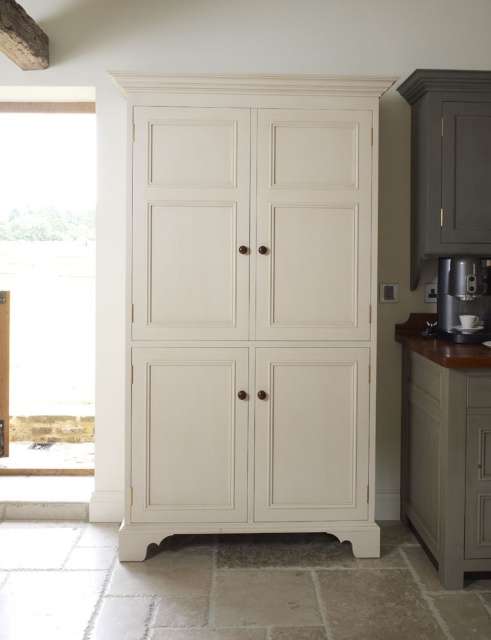
Question: Is satin silver metallic coffee machine at right to the left of wooden textured exhaust hood at upper left from the viewer's perspective?

Choices:
 (A) no
 (B) yes

Answer: (A)

Question: Does satin silver metallic coffee machine at right appear under wooden textured exhaust hood at upper left?

Choices:
 (A) yes
 (B) no

Answer: (A)

Question: Which of the following is the farthest from the observer?

Choices:
 (A) (463, 307)
 (B) (257, 420)

Answer: (A)

Question: In this image, where is matte cream cabinet at center located relative to satin silver metallic coffee machine at right?

Choices:
 (A) right
 (B) left

Answer: (B)

Question: Estimate the real-world distances between objects in this image. Which object is closer to the wooden textured exhaust hood at upper left?

Choices:
 (A) matte cream cabinet at center
 (B) satin silver metallic coffee machine at right

Answer: (A)

Question: Based on their relative distances, which object is farther from the satin silver metallic coffee machine at right?

Choices:
 (A) matte cream cabinet at center
 (B) wooden textured exhaust hood at upper left

Answer: (B)